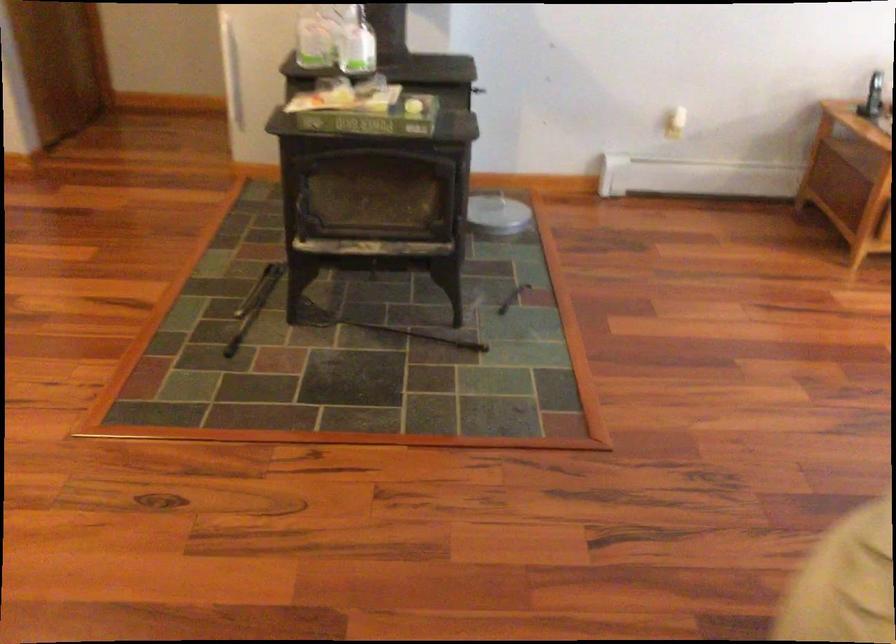
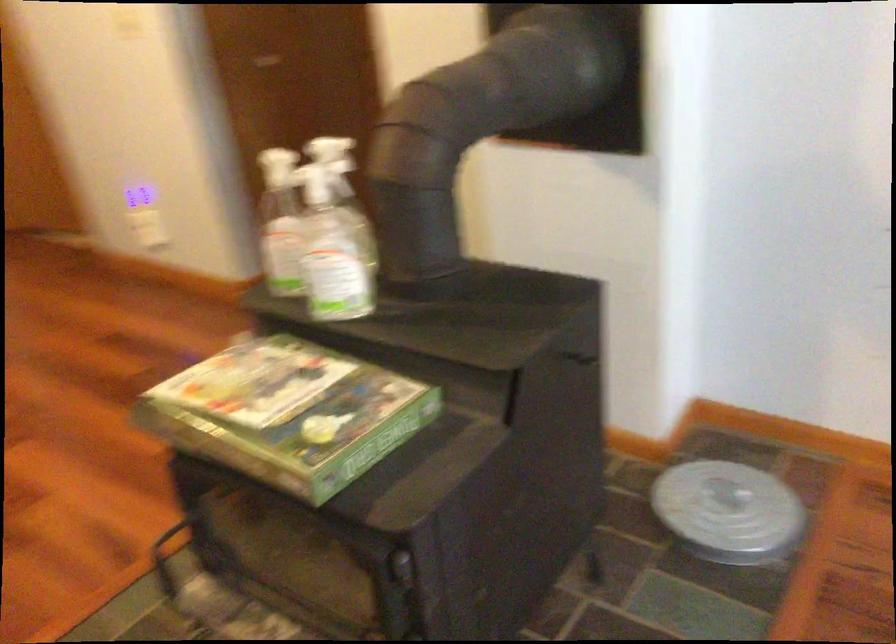
In the second image, find the point that corresponds to the point at 501,207 in the first image.

(728, 512)